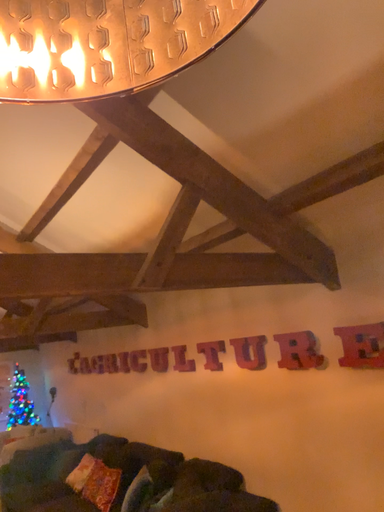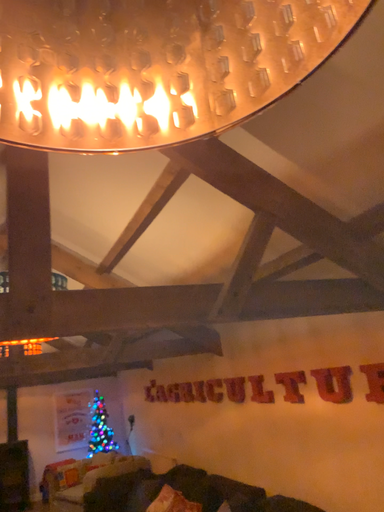
Question: How did the camera likely rotate when shooting the video?

Choices:
 (A) rotated left
 (B) rotated right

Answer: (A)